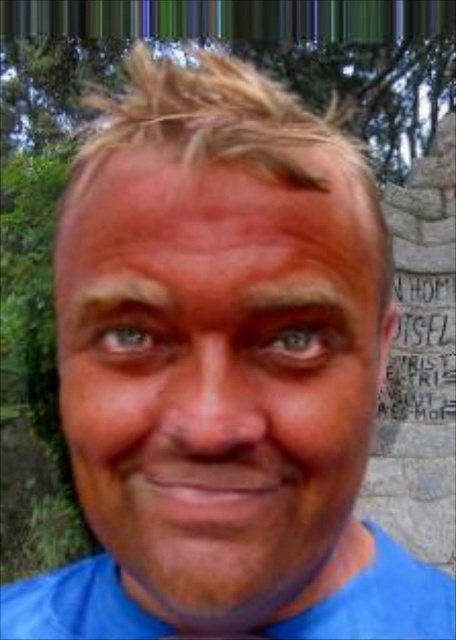
Question: Can you confirm if blue matte face at center is thinner than blue cotton shirt at lower center?

Choices:
 (A) yes
 (B) no

Answer: (A)

Question: Which of these objects is positioned farthest from the brown hair at upper left?

Choices:
 (A) blue cotton shirt at lower center
 (B) blue matte face at center
 (C) reddish skin at center

Answer: (A)

Question: Does reddish skin at center have a smaller size compared to blue cotton shirt at lower center?

Choices:
 (A) no
 (B) yes

Answer: (B)

Question: Does reddish skin at center have a larger size compared to brown hair at upper left?

Choices:
 (A) no
 (B) yes

Answer: (B)

Question: Which is farther from the blue matte face at center?

Choices:
 (A) brown hair at upper left
 (B) brown matte eyebrow at upper center
 (C) blue cotton shirt at lower center
 (D) reddish skin at center

Answer: (C)

Question: Which object is positioned closest to the brown hair at upper left?

Choices:
 (A) blue matte face at center
 (B) brown matte eyebrow at upper center
 (C) blue cotton shirt at lower center
 (D) reddish skin at center

Answer: (D)